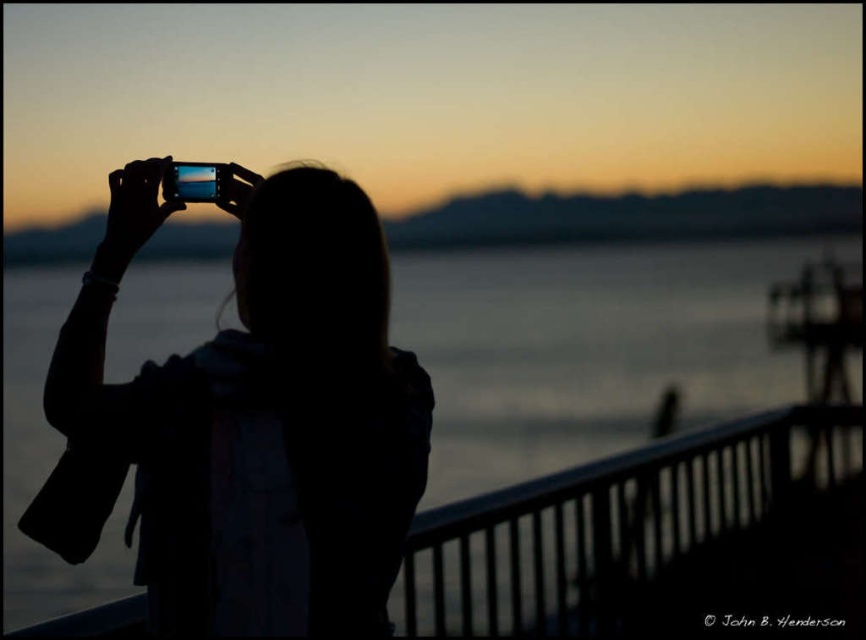
Does silhouette hair at center have a lesser width compared to transparent water at center?

Yes, silhouette hair at center is thinner than transparent water at center.

Which is more to the left, silhouette hair at center or transparent water at center?

transparent water at center

I want to click on silhouette hair at center, so click(260, 416).